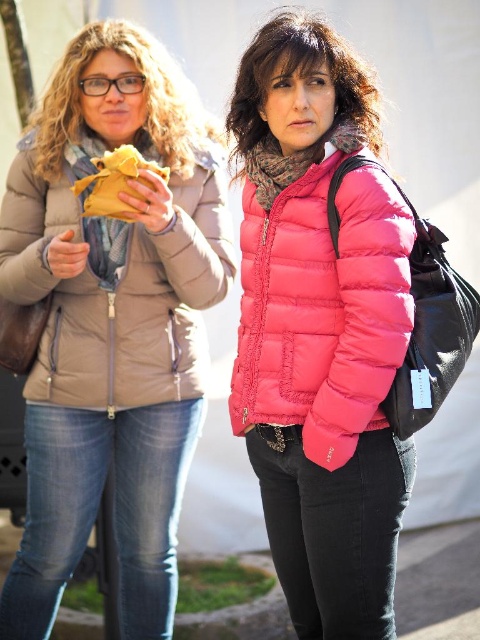
You are a fashion designer observing two jackets in an outdoor setting. The pink quilted jacket at center and the matte beige jacket at left. Which one has a larger size?

The pink quilted jacket at center is bigger than the matte beige jacket at left, so the pink quilted jacket at center has a larger size.